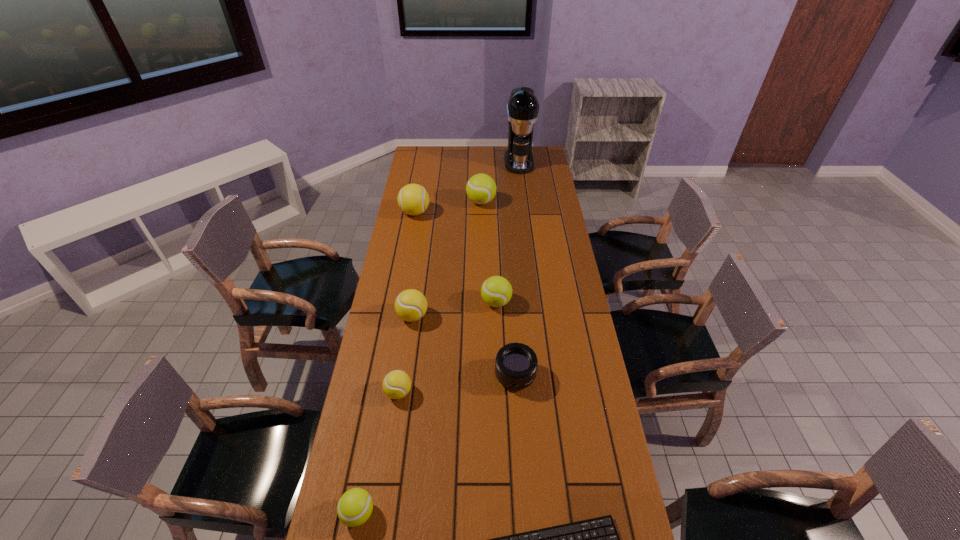
Where is `object that is at the right edge`? object that is at the right edge is located at coordinates (522, 109).

At what (x,y) coordinates should I click in order to perform the action: click on object positioned at the far right corner. Please return your answer as a coordinate pair (x, y). Image resolution: width=960 pixels, height=540 pixels. Looking at the image, I should click on (522, 109).

In the image, there is a desktop. Identify the location of free space at the far edge. Image resolution: width=960 pixels, height=540 pixels. (507, 147).

In the image, there is a desktop. Where is `free space at the left edge`? free space at the left edge is located at coordinates (384, 495).

Locate an element on the screen. vacant space at the right edge of the desktop is located at coordinates (570, 266).

I want to click on free space at the far left corner, so click(421, 163).

I want to click on free area in between the second smallest green tennis ball and the biggest green tennis ball, so click(x=489, y=252).

The height and width of the screenshot is (540, 960). In order to click on free space between the smallest green tennis ball and the smallest yellow tennis ball in this screenshot , I will do `click(378, 453)`.

Identify the location of unoccupied area between the coffee maker and the nearest yellow tennis ball. The height and width of the screenshot is (540, 960). (459, 277).

The image size is (960, 540). What are the coordinates of `vacant space that's between the farthest object and the second nearest yellow tennis ball` in the screenshot? It's located at (466, 239).